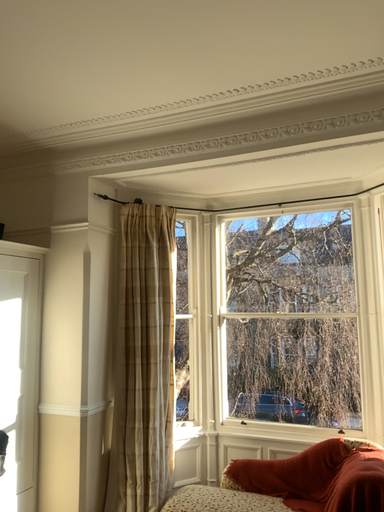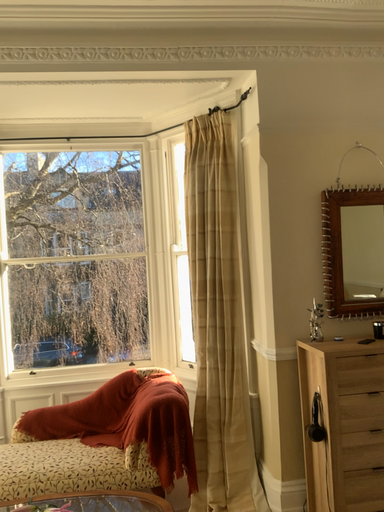
Question: Which way did the camera rotate in the video?

Choices:
 (A) rotated upward
 (B) rotated downward

Answer: (B)